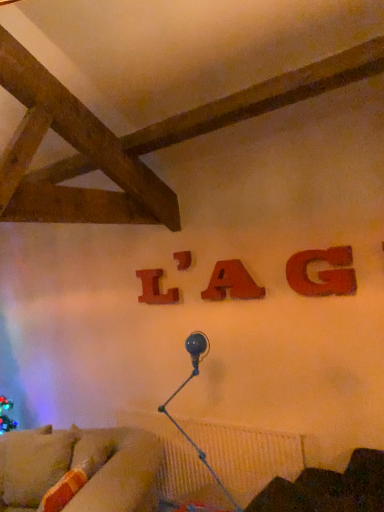
Question: Do you think wooden letter at center, the third alphabet viewed from the right, is within velvet beige couch at lower left, or outside of it?

Choices:
 (A) outside
 (B) inside

Answer: (A)

Question: Based on their positions, is wooden letter at center, the third alphabet viewed from the right, located to the left or right of velvet beige couch at lower left?

Choices:
 (A) left
 (B) right

Answer: (B)

Question: Based on their relative distances, which object is nearer to the wooden letter at center, which is counted as the third alphabet, starting from the front?

Choices:
 (A) velvet beige couch at lower left
 (B) matte wood letter g at upper right, placed as the 1th alphabet when sorted from right to left
 (C) metallic blue lamp at lower center
 (D) wooden letter a at center, which is counted as the second alphabet, starting from the front
 (E) velvet dark brown armchair at lower right

Answer: (D)

Question: Based on their relative distances, which object is farther from the matte wood letter g at upper right, the fourth alphabet when ordered from back to front?

Choices:
 (A) metallic blue lamp at lower center
 (B) wooden letter a at center, the 2th alphabet from the right
 (C) wooden letter l at center, which is the 1th alphabet in left-to-right order
 (D) velvet dark brown armchair at lower right
 (E) wooden letter at center, arranged as the 2th alphabet when viewed from the back

Answer: (C)